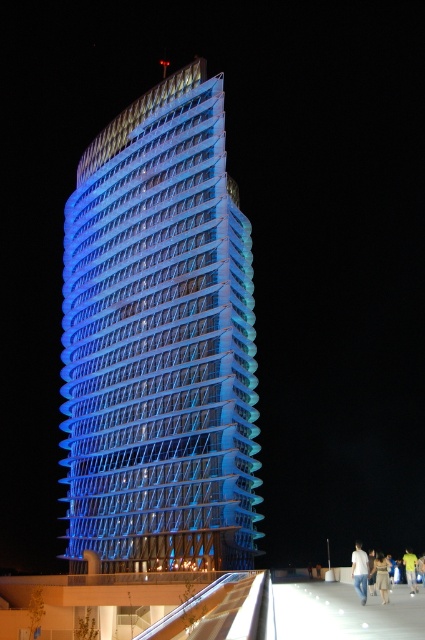
Question: Is white cotton shirt at lower right wider than yellow t-shirt at lower right?

Choices:
 (A) yes
 (B) no

Answer: (B)

Question: Which point appears closest to the camera in this image?

Choices:
 (A) (405, 576)
 (B) (388, 589)
 (C) (212, 232)

Answer: (B)

Question: Estimate the real-world distances between objects in this image. Which object is farther from the white cotton shirt at lower right?

Choices:
 (A) light brown fabric dress at lower right
 (B) yellow t-shirt at lower right

Answer: (B)

Question: Where is light brown fabric dress at lower right located in relation to yellow t-shirt at lower right in the image?

Choices:
 (A) right
 (B) left

Answer: (B)

Question: Does white cotton shirt at lower right appear over yellow t-shirt at lower right?

Choices:
 (A) yes
 (B) no

Answer: (A)

Question: Which point is closer to the camera?

Choices:
 (A) (410, 564)
 (B) (130, 236)
 (C) (382, 589)
 (D) (362, 593)

Answer: (D)